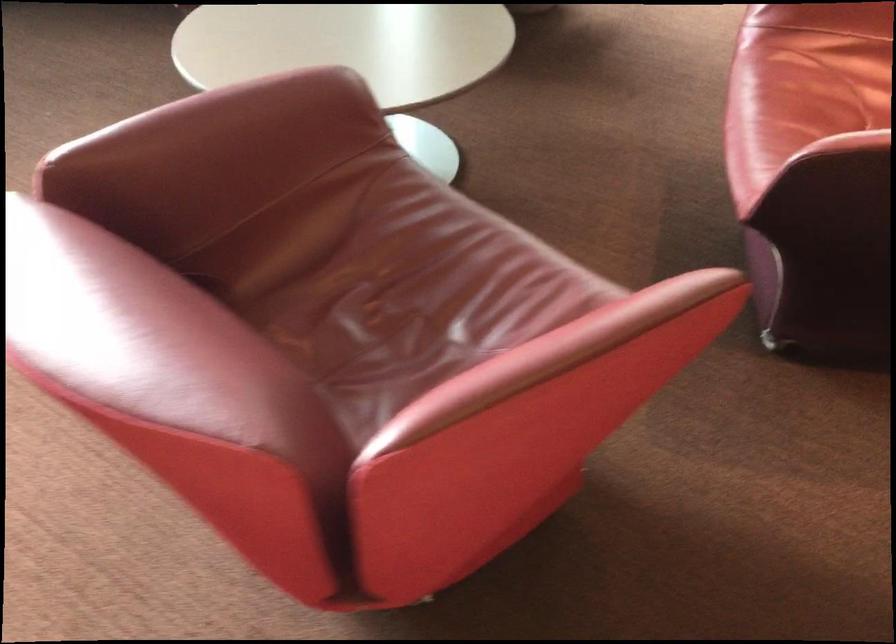
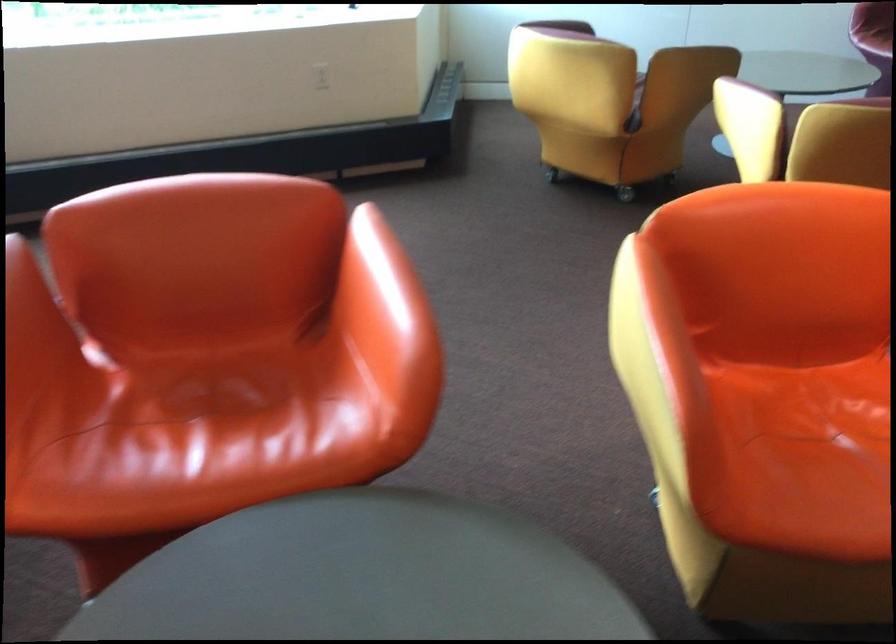
Question: Which direction would the cameraman need to move to produce the second image? Reply with the corresponding letter.

Choices:
 (A) Left
 (B) Right
 (C) Forward
 (D) Backward

Answer: (B)